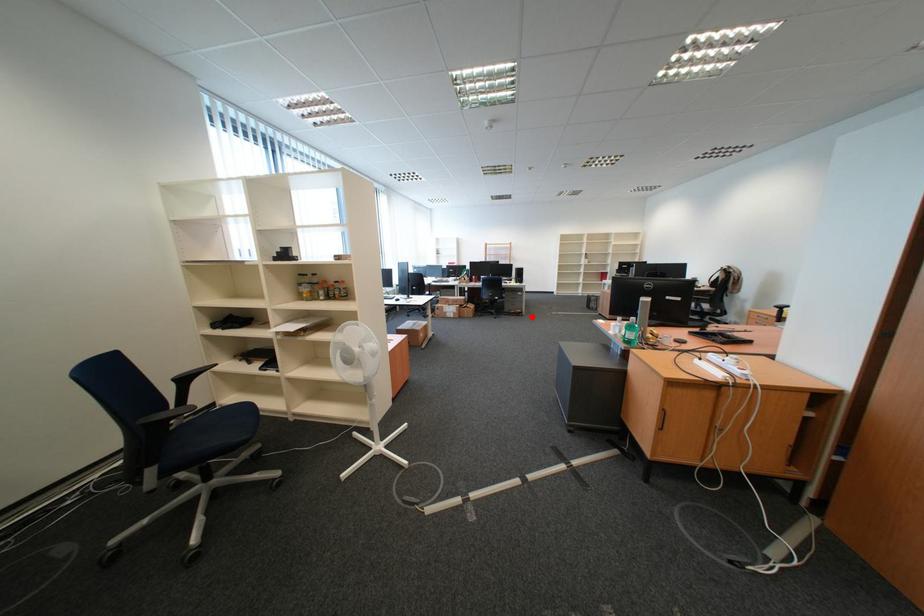
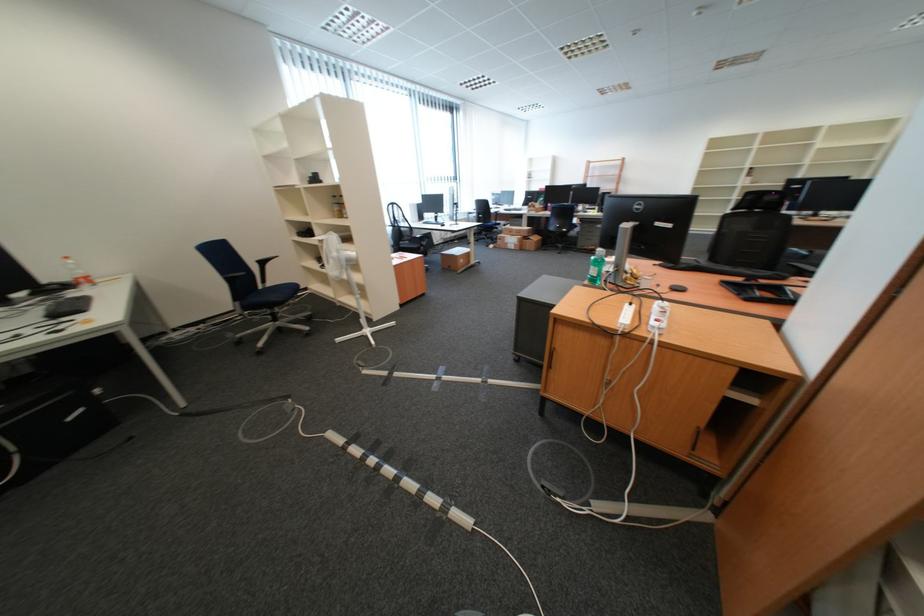
In the second image, find the point that corresponds to the highlighted location in the first image.

(604, 254)